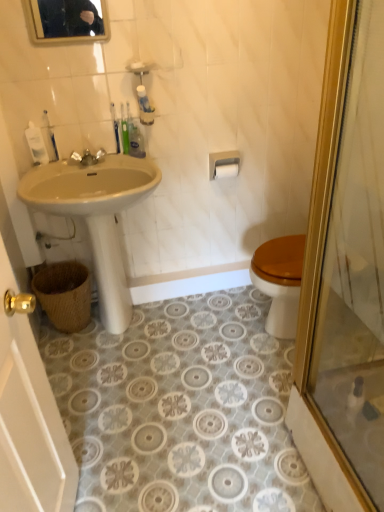
Question: Is gold-framed mirror at upper center wider than white plastic toothpaste tube at upper left, which is the 2th toiletry from right to left?

Choices:
 (A) no
 (B) yes

Answer: (A)

Question: From a real-world perspective, does gold-framed mirror at upper center sit lower than white plastic toothpaste tube at upper left, which is the 2th toiletry from right to left?

Choices:
 (A) yes
 (B) no

Answer: (B)

Question: Considering the relative sizes of gold-framed mirror at upper center and white plastic toothpaste tube at upper left, which is the 2th toiletry from right to left, in the image provided, is gold-framed mirror at upper center shorter than white plastic toothpaste tube at upper left, which is the 2th toiletry from right to left,?

Choices:
 (A) yes
 (B) no

Answer: (B)

Question: Is gold-framed mirror at upper center at the right side of white plastic toothpaste tube at upper left, which appears as the 2th toiletry when viewed from the left?

Choices:
 (A) no
 (B) yes

Answer: (B)

Question: Is gold-framed mirror at upper center behind white plastic toothpaste tube at upper left, which appears as the 2th toiletry when viewed from the left?

Choices:
 (A) yes
 (B) no

Answer: (B)

Question: Is gold-framed mirror at upper center aimed at white plastic toothpaste tube at upper left, which appears as the 2th toiletry when viewed from the left?

Choices:
 (A) yes
 (B) no

Answer: (B)

Question: Could you tell me if white matte toilet paper at upper center is facing gold-framed mirror at upper center?

Choices:
 (A) yes
 (B) no

Answer: (B)

Question: Is the depth of white matte toilet paper at upper center greater than that of gold-framed mirror at upper center?

Choices:
 (A) no
 (B) yes

Answer: (B)

Question: Can you confirm if white matte toilet paper at upper center is taller than gold-framed mirror at upper center?

Choices:
 (A) yes
 (B) no

Answer: (B)

Question: Is white matte toilet paper at upper center located outside gold-framed mirror at upper center?

Choices:
 (A) yes
 (B) no

Answer: (A)

Question: Can you confirm if white matte toilet paper at upper center is shorter than gold-framed mirror at upper center?

Choices:
 (A) no
 (B) yes

Answer: (B)

Question: Considering the relative sizes of white matte toilet paper at upper center and gold-framed mirror at upper center in the image provided, is white matte toilet paper at upper center bigger than gold-framed mirror at upper center?

Choices:
 (A) no
 (B) yes

Answer: (A)

Question: Can you confirm if white matte toilet paper at upper center is positioned to the left of green matte tube at upper center, the first toiletry when ordered from right to left?

Choices:
 (A) yes
 (B) no

Answer: (B)